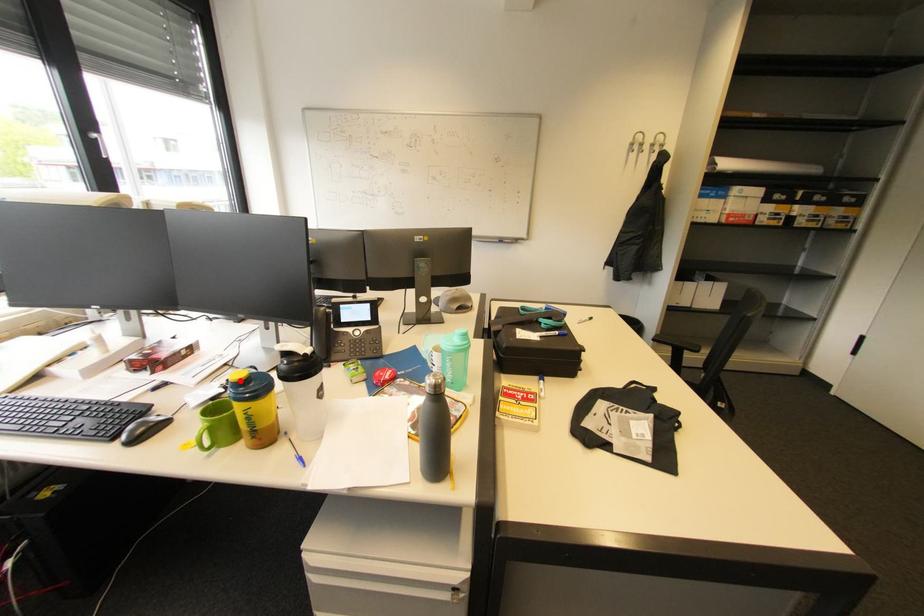
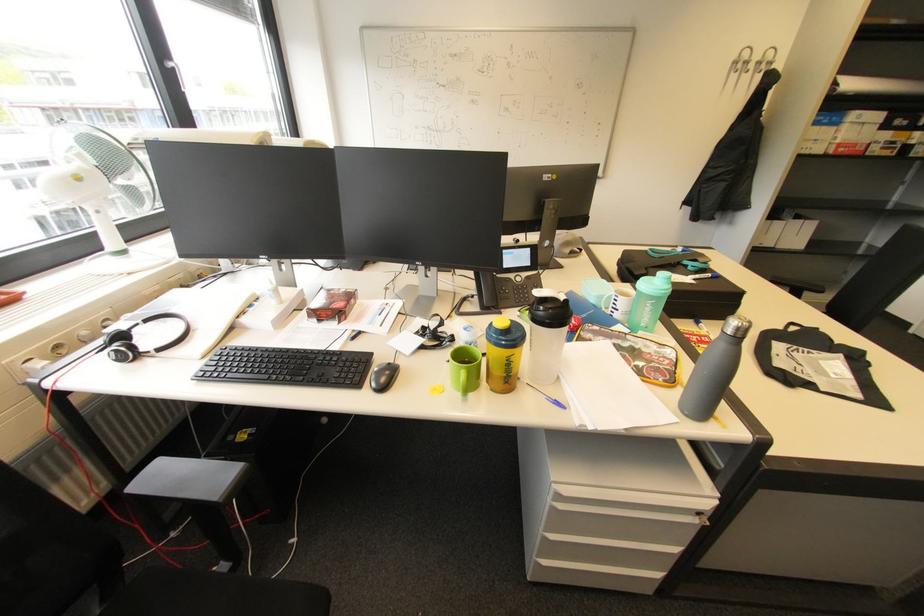
The point at the highlighted location is marked in the first image. Where is the corresponding point in the second image?

(508, 328)